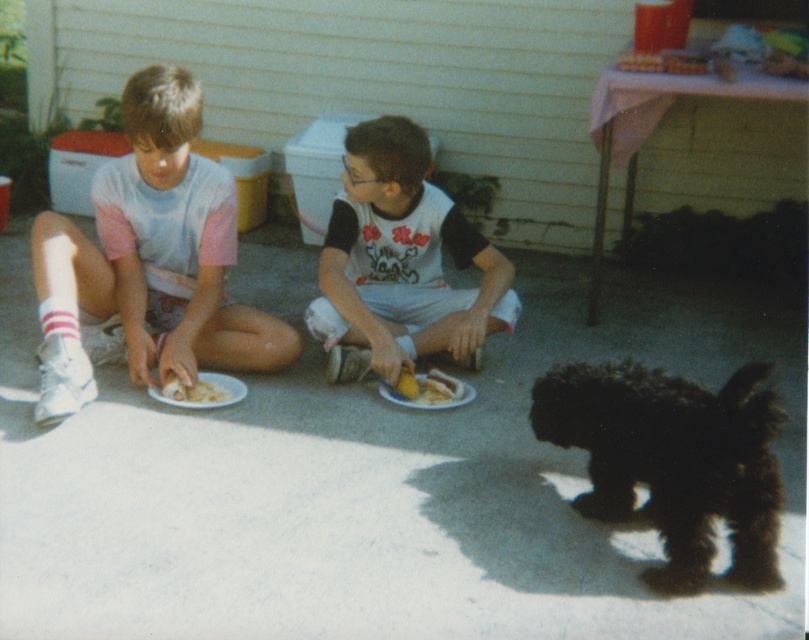
Between white cotton shirt at center and white glossy plate at lower center, which one appears on the right side from the viewer's perspective?

From the viewer's perspective, white glossy plate at lower center appears more on the right side.

Which is behind, point (375, 294) or point (472, 397)?

The point (375, 294) is behind.

In order to click on white cotton shirt at center in this screenshot , I will do `click(401, 257)`.

Is point (54, 349) positioned behind point (742, 496)?

Yes, point (54, 349) is farther from viewer.

Which is more to the left, matte white shirt at left or black fluffy dog at lower right?

matte white shirt at left

The width and height of the screenshot is (809, 640). Describe the element at coordinates (149, 259) in the screenshot. I see `matte white shirt at left` at that location.

The width and height of the screenshot is (809, 640). I want to click on matte white shirt at left, so click(149, 259).

Measure the distance between point (142, 278) and camera.

A distance of 12.53 feet exists between point (142, 278) and camera.

Who is more forward, (138,269) or (392,182)?

Point (392,182)

At what (x,y) coordinates should I click in order to perform the action: click on matte white shirt at left. Please return your answer as a coordinate pair (x, y). Looking at the image, I should click on (149, 259).